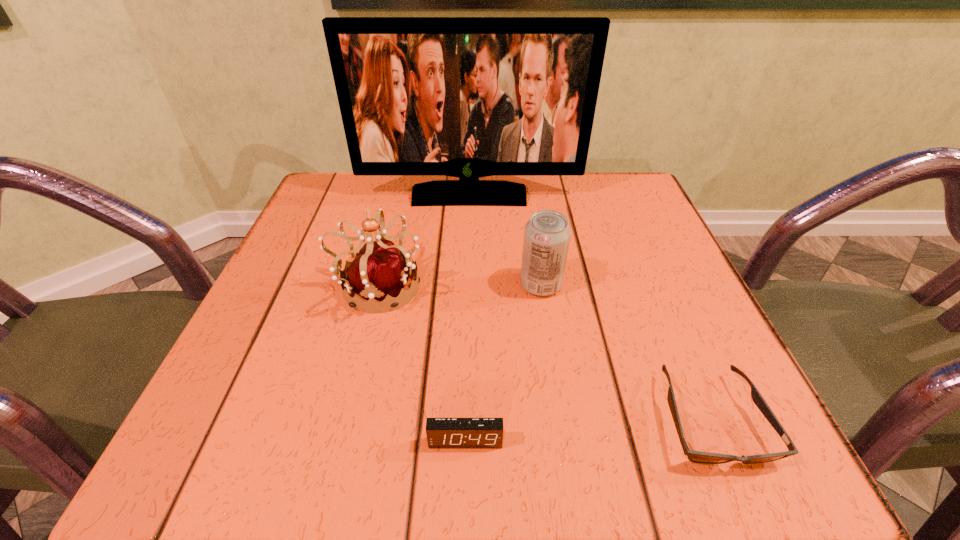
At what (x,y) coordinates should I click in order to perform the action: click on the tallest object. Please return your answer as a coordinate pair (x, y). This screenshot has width=960, height=540. Looking at the image, I should click on (468, 97).

Where is `the farthest object`? The image size is (960, 540). the farthest object is located at coordinates (468, 97).

Locate an element on the screen. This screenshot has height=540, width=960. the second tallest object is located at coordinates (379, 271).

At what (x,y) coordinates should I click in order to perform the action: click on soda can. Please return your answer as a coordinate pair (x, y). Image resolution: width=960 pixels, height=540 pixels. Looking at the image, I should click on (547, 234).

Where is `alarm clock`? alarm clock is located at coordinates (441, 432).

Identify the location of sunglasses. The width and height of the screenshot is (960, 540). (694, 456).

The image size is (960, 540). In order to click on the rightmost object in this screenshot , I will do `click(694, 456)`.

The image size is (960, 540). Find the location of `blank space located 0.400m on the front-facing side of the monitor`. blank space located 0.400m on the front-facing side of the monitor is located at coordinates (464, 353).

This screenshot has width=960, height=540. Find the location of `free space located on the front-facing side of the tiara`. free space located on the front-facing side of the tiara is located at coordinates (492, 287).

What are the coordinates of `free space located 0.070m on the left of the soda can` in the screenshot? It's located at (480, 285).